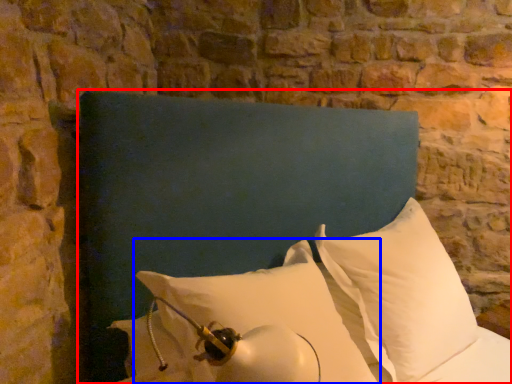
Question: Which point is further to the camera, furniture (highlighted by a red box) or pillow (highlighted by a blue box)?

Choices:
 (A) furniture
 (B) pillow

Answer: (B)